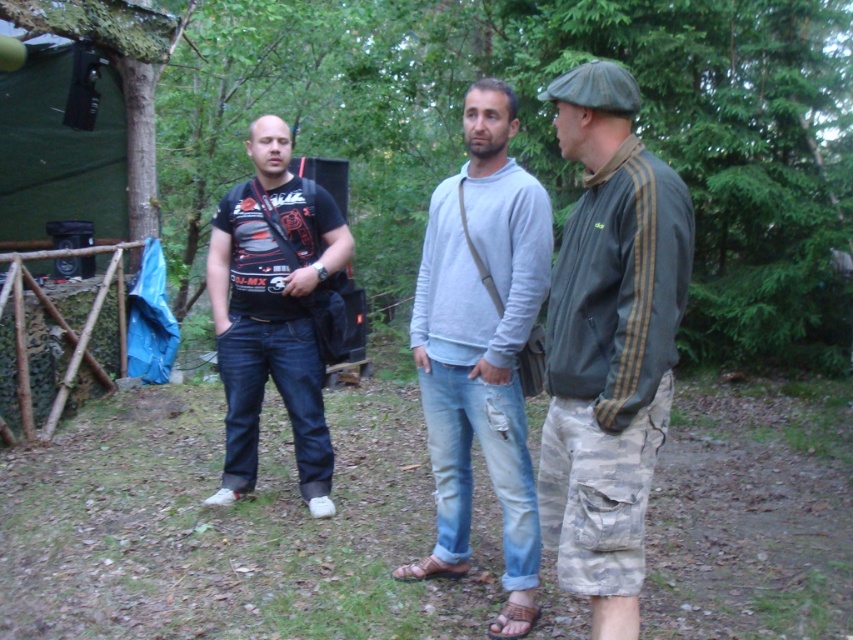
Question: Based on their relative distances, which object is nearer to the black matte t-shirt at center?

Choices:
 (A) gray cotton sweater at center
 (B) camouflage cargo shorts at right

Answer: (A)

Question: Is camouflage cargo shorts at right above black matte t-shirt at center?

Choices:
 (A) no
 (B) yes

Answer: (A)

Question: Which object is farther from the camera taking this photo?

Choices:
 (A) gray cotton sweater at center
 (B) camouflage cargo shorts at right

Answer: (A)

Question: Is camouflage cargo shorts at right bigger than black matte t-shirt at center?

Choices:
 (A) no
 (B) yes

Answer: (A)

Question: Does camouflage cargo shorts at right appear on the left side of black matte t-shirt at center?

Choices:
 (A) yes
 (B) no

Answer: (B)

Question: Which object is positioned closest to the camouflage cargo shorts at right?

Choices:
 (A) black matte t-shirt at center
 (B) gray cotton sweater at center

Answer: (B)